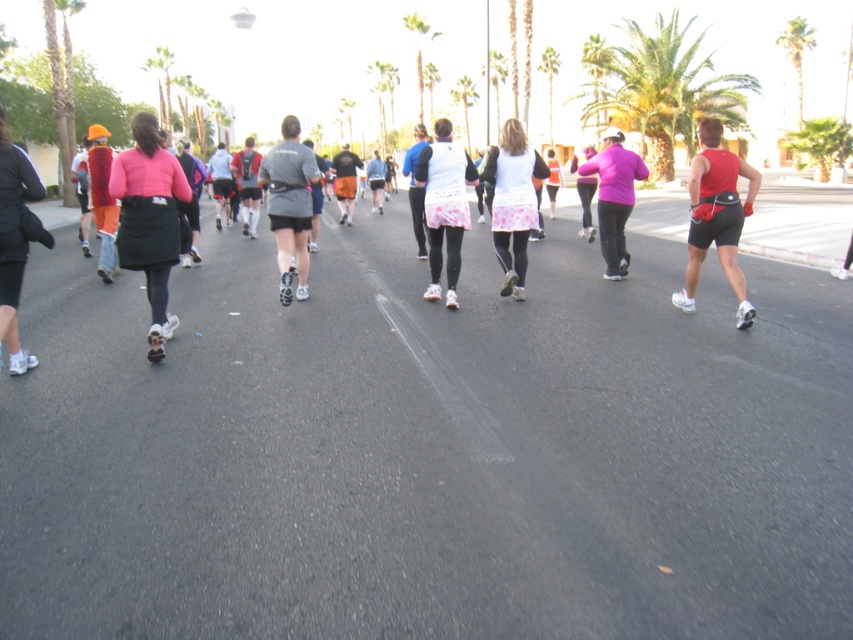
Question: Estimate the real-world distances between objects in this image. Which object is farther from the pink matte jacket at center?

Choices:
 (A) white plastic roller skate at lower left
 (B) gray matte shorts at center
 (C) green leafy palm tree at upper right

Answer: (C)

Question: Is green leafy palm tree at upper right further to camera compared to white matte skirt at center?

Choices:
 (A) no
 (B) yes

Answer: (B)

Question: Does green leafy palm tree at upper right have a smaller size compared to white matte tank top at center?

Choices:
 (A) no
 (B) yes

Answer: (A)

Question: Can you confirm if pink matte skirt at center is positioned to the left of gray matte shorts at center?

Choices:
 (A) yes
 (B) no

Answer: (A)

Question: Which object is positioned closest to the green leafy palm tree at upper right?

Choices:
 (A) gray matte shorts at center
 (B) pink matte jacket at center

Answer: (B)

Question: Estimate the real-world distances between objects in this image. Which object is farther from the white plastic roller skate at lower left?

Choices:
 (A) gray matte shorts at center
 (B) red matte shorts at right
 (C) white matte tank top at center

Answer: (B)